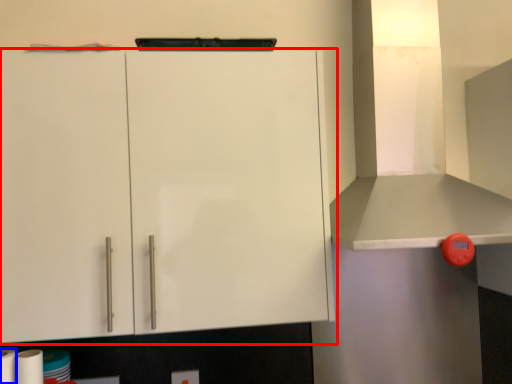
Question: Among these objects, which one is farthest to the camera, cabinetry (highlighted by a red box) or paper towel (highlighted by a blue box)?

Choices:
 (A) cabinetry
 (B) paper towel

Answer: (A)